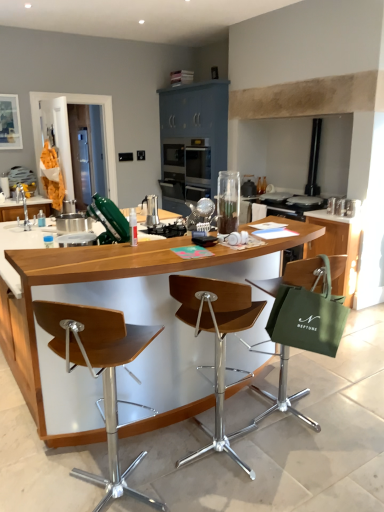
Where is `free space behind green fabric chair at right, the first chair when ordered from right to left`? The image size is (384, 512). free space behind green fabric chair at right, the first chair when ordered from right to left is located at coordinates (289, 375).